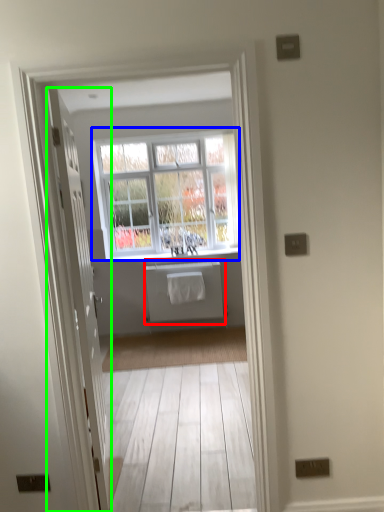
Question: Estimate the real-world distances between objects in this image. Which object is farther from appliance (highlighted by a red box), window (highlighted by a blue box) or door (highlighted by a green box)?

Choices:
 (A) window
 (B) door

Answer: (B)